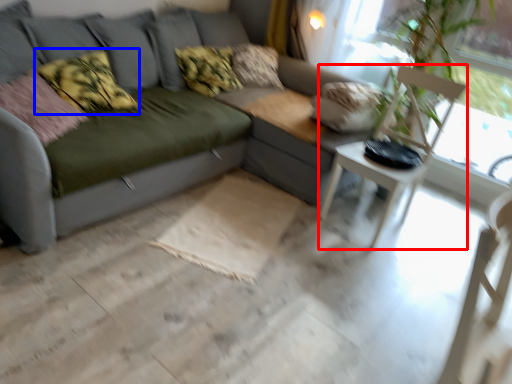
Question: Which of the following is the farthest to the observer, armchair (highlighted by a red box) or pillow (highlighted by a blue box)?

Choices:
 (A) armchair
 (B) pillow

Answer: (B)